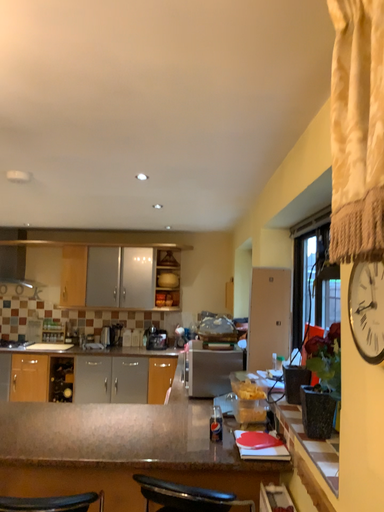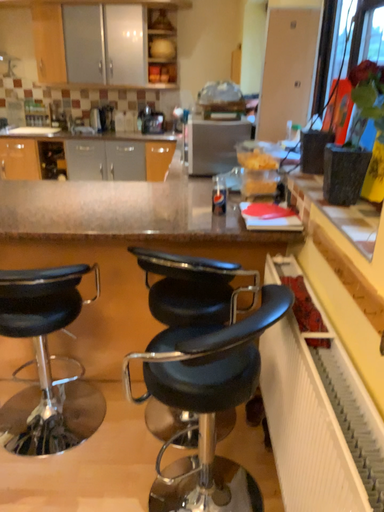
Question: How did the camera likely rotate when shooting the video?

Choices:
 (A) rotated downward
 (B) rotated upward

Answer: (A)